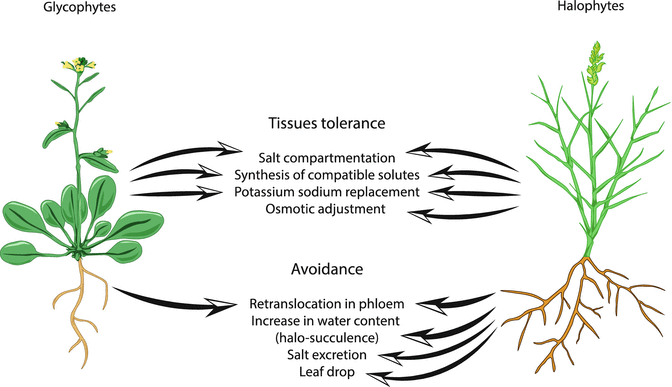
This screenshot has height=387, width=672. What are the coordinates of `empty space left of right plant` in the screenshot? It's located at (453, 262).